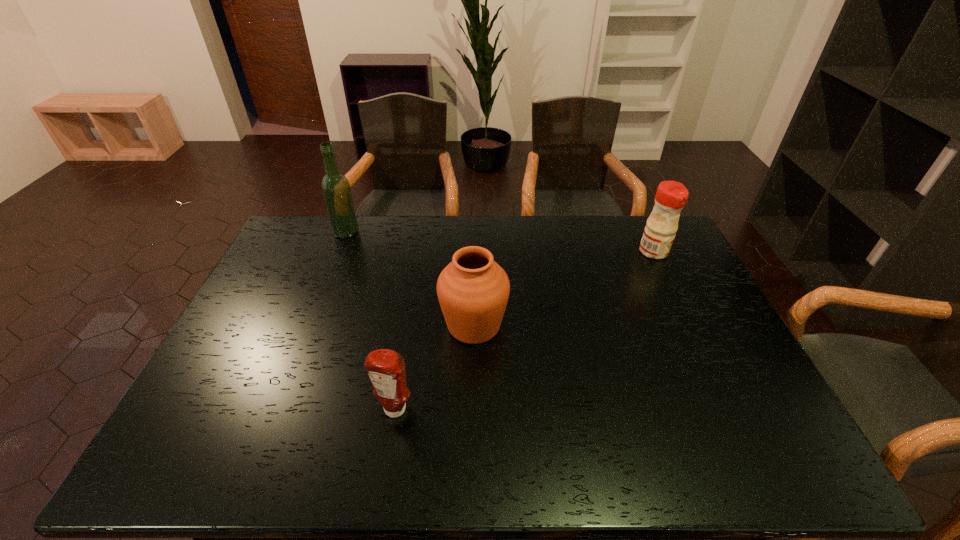
The height and width of the screenshot is (540, 960). I want to click on free space located 0.170m on the front of the third farthest object, so click(472, 406).

Locate an element on the screen. Image resolution: width=960 pixels, height=540 pixels. free location located on the back of the third object from right to left is located at coordinates (410, 318).

Identify the location of liquor at the far edge. Image resolution: width=960 pixels, height=540 pixels. (336, 189).

This screenshot has width=960, height=540. I want to click on condiment at the far edge, so click(671, 196).

This screenshot has width=960, height=540. Find the location of `object present at the right edge`. object present at the right edge is located at coordinates point(671,196).

The image size is (960, 540). I want to click on object that is at the far right corner, so [x=671, y=196].

In the image, there is a desktop. Identify the location of vacant space at the far edge. (481, 247).

Locate an element on the screen. free location at the near edge is located at coordinates (390, 460).

At what (x,y) coordinates should I click in order to perform the action: click on vacant space at the right edge. Please return your answer as a coordinate pair (x, y). Image resolution: width=960 pixels, height=540 pixels. Looking at the image, I should click on (716, 417).

Locate an element on the screen. This screenshot has height=540, width=960. free space that is in between the second farthest object and the nearer condiment is located at coordinates 524,331.